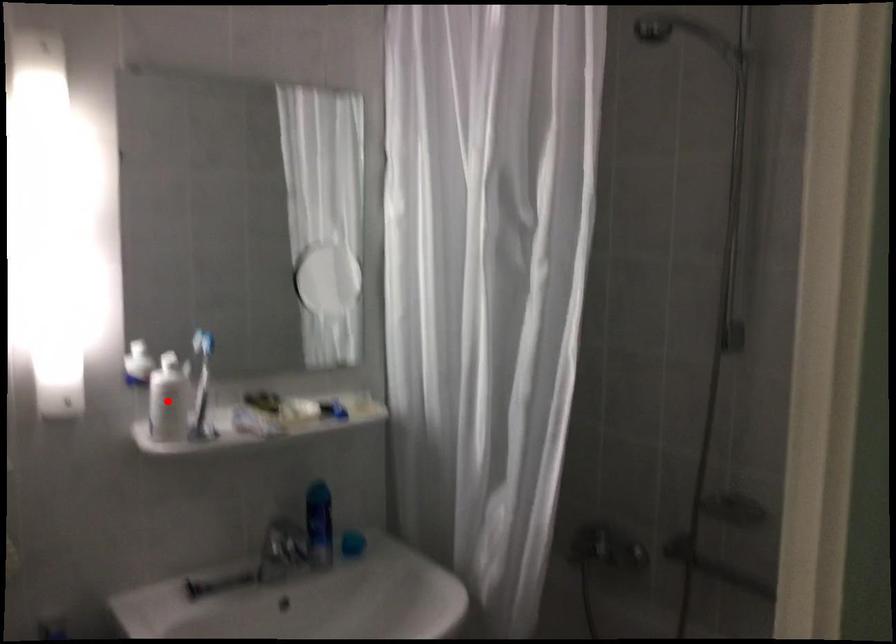
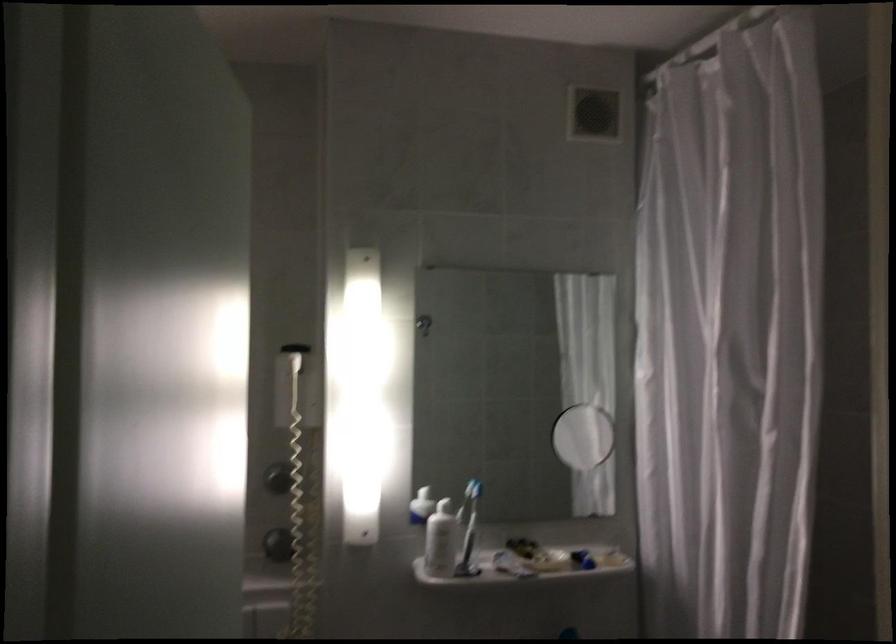
Find the pixel in the second image that matches the highlighted location in the first image.

(441, 541)